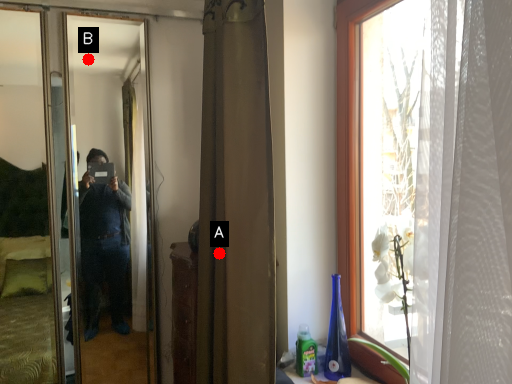
Question: Two points are circled on the image, labeled by A and B beside each circle. Which point appears farthest from the camera in this image?

Choices:
 (A) A is further
 (B) B is further

Answer: (B)